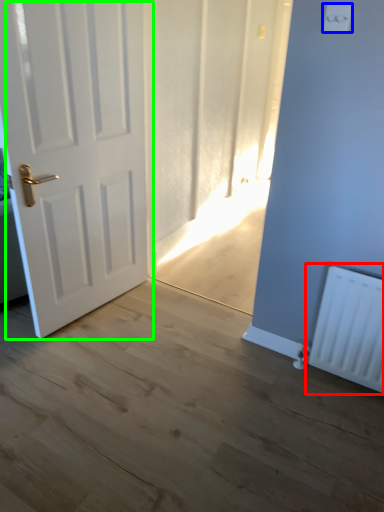
Question: Which is farther away from radiator (highlighted by a red box)? light switch (highlighted by a blue box) or door (highlighted by a green box)?

Choices:
 (A) light switch
 (B) door

Answer: (B)